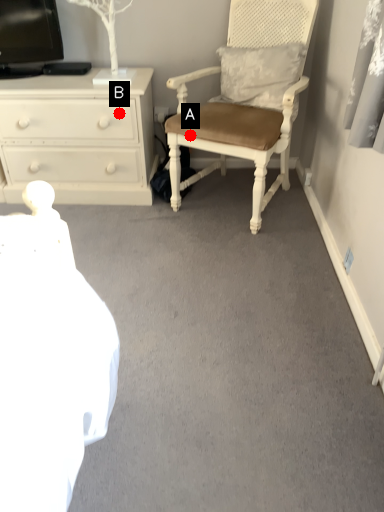
Question: Two points are circled on the image, labeled by A and B beside each circle. Among these points, which one is farthest from the camera?

Choices:
 (A) A is further
 (B) B is further

Answer: (B)